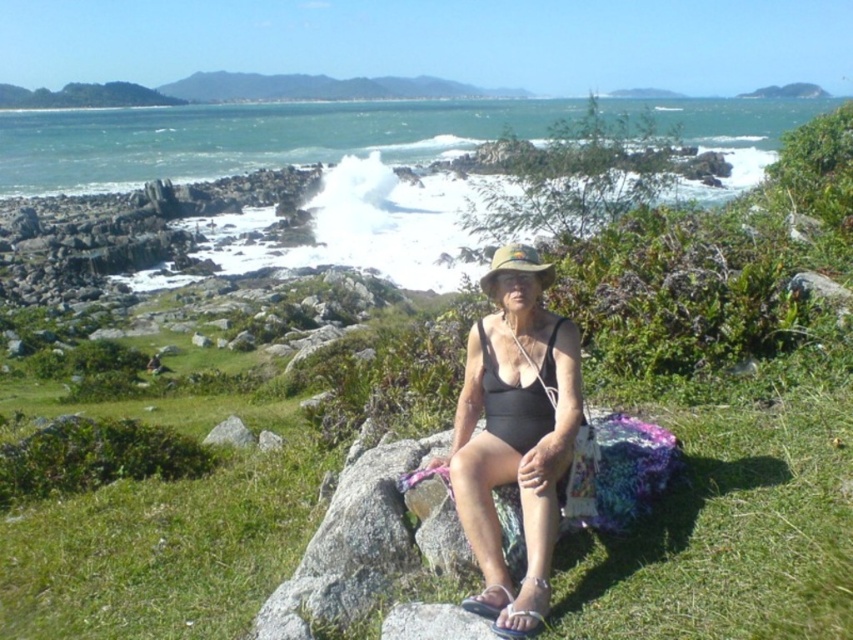
Can you confirm if black matte bikini top at center is positioned to the right of gray rock at center?

Correct, you'll find black matte bikini top at center to the right of gray rock at center.

Does black matte bikini top at center appear under gray rock at center?

Actually, black matte bikini top at center is above gray rock at center.

What do you see at coordinates (492, 369) in the screenshot? Image resolution: width=853 pixels, height=640 pixels. I see `black matte bikini top at center` at bounding box center [492, 369].

You are a GUI agent. You are given a task and a screenshot of the screen. Output one action in this format:
    pyautogui.click(x=<x>, y=<y>)
    Task: Click on the black matte bikini top at center
    The width and height of the screenshot is (853, 640).
    Given the screenshot: What is the action you would take?
    pyautogui.click(x=492, y=369)

Measure the distance from matte black swimsuit at center to green fabric hat at center.

matte black swimsuit at center and green fabric hat at center are 29.15 inches apart.

Who is more forward, (479, 451) or (531, 256)?

Positioned in front is point (479, 451).

Between point (549, 314) and point (512, 268), which one is positioned in front?

Positioned in front is point (512, 268).

At what (x,y) coordinates should I click in order to perform the action: click on matte black swimsuit at center. Please return your answer as a coordinate pair (x, y). Image resolution: width=853 pixels, height=640 pixels. Looking at the image, I should click on (515, 433).

Can you confirm if matte black swimsuit at center is smaller than gray rock at center?

No, matte black swimsuit at center is not smaller than gray rock at center.

Is point (525, 420) closer to viewer compared to point (209, 435)?

Yes, it is.

Where is `matte black swimsuit at center`? This screenshot has width=853, height=640. matte black swimsuit at center is located at coordinates (515, 433).